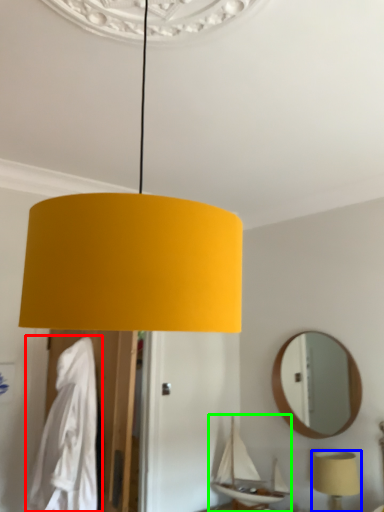
Question: Estimate the real-world distances between objects in this image. Which object is farther from robe (highlighted by a red box), lamp (highlighted by a blue box) or boat (highlighted by a green box)?

Choices:
 (A) lamp
 (B) boat

Answer: (A)